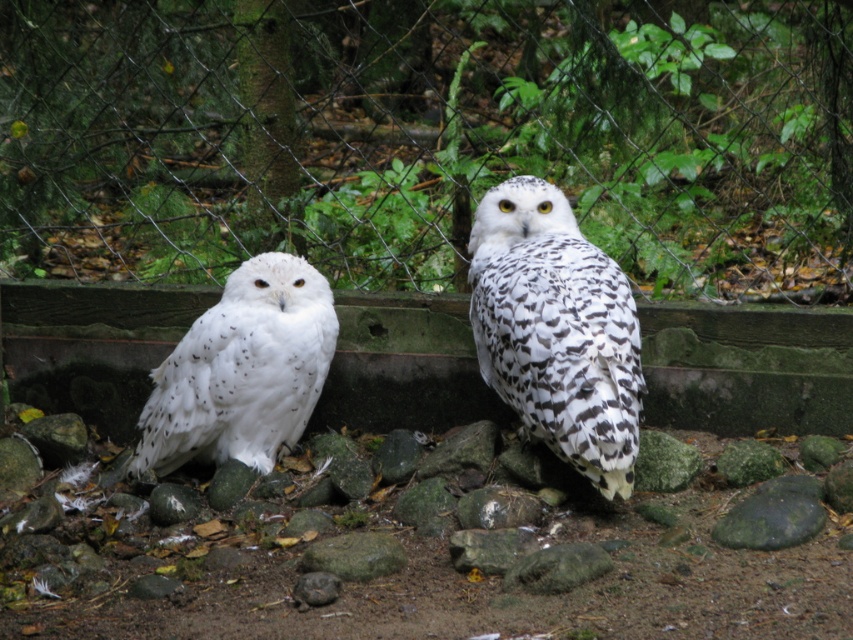
You are a zookeeper observing the two snowy owls in their enclosure. You notice that the speckled white owl at center and the white speckled owl at left are positioned in a way that one is closer to you than the other. Which owl is closer to you?

The speckled white owl at center is closer to you because it is in front of the white speckled owl at left.

You are a zookeeper observing the enclosure. You notice the white speckled owl at left and the gray rough rock at center. Which object is positioned farther to the east if the enclosure faces north?

The white speckled owl at left is to the left of gray rough rock at center. Since the enclosure faces north, left would correspond to the west direction. Therefore, the gray rough rock at center is positioned farther to the east compared to the white speckled owl at left.